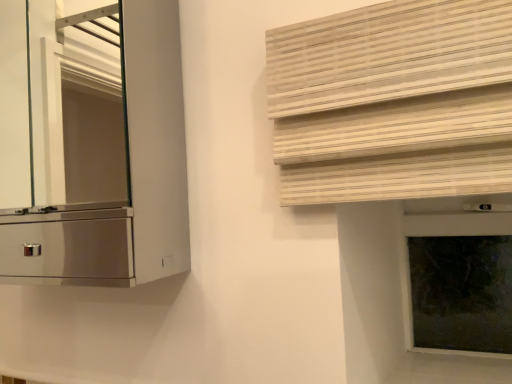
Question: Does natural wood blinds at upper right have a lesser height compared to metallic silver cabinet at left?

Choices:
 (A) no
 (B) yes

Answer: (B)

Question: From the image's perspective, would you say natural wood blinds at upper right is shown under metallic silver cabinet at left?

Choices:
 (A) no
 (B) yes

Answer: (B)

Question: Can you confirm if natural wood blinds at upper right is wider than metallic silver cabinet at left?

Choices:
 (A) no
 (B) yes

Answer: (A)

Question: Is natural wood blinds at upper right in front of metallic silver cabinet at left?

Choices:
 (A) no
 (B) yes

Answer: (B)

Question: Considering the relative sizes of natural wood blinds at upper right and metallic silver cabinet at left in the image provided, is natural wood blinds at upper right bigger than metallic silver cabinet at left?

Choices:
 (A) yes
 (B) no

Answer: (B)

Question: Is natural wood blinds at upper right outside of metallic silver cabinet at left?

Choices:
 (A) no
 (B) yes

Answer: (B)

Question: Can you confirm if dark glass window frame at right is taller than metallic silver cabinet at left?

Choices:
 (A) yes
 (B) no

Answer: (B)

Question: Does dark glass window frame at right turn towards metallic silver cabinet at left?

Choices:
 (A) no
 (B) yes

Answer: (A)

Question: Could metallic silver cabinet at left be considered to be inside dark glass window frame at right?

Choices:
 (A) no
 (B) yes

Answer: (A)

Question: From a real-world perspective, is dark glass window frame at right located higher than metallic silver cabinet at left?

Choices:
 (A) no
 (B) yes

Answer: (A)

Question: Considering the relative sizes of dark glass window frame at right and metallic silver cabinet at left in the image provided, is dark glass window frame at right smaller than metallic silver cabinet at left?

Choices:
 (A) yes
 (B) no

Answer: (A)

Question: Is dark glass window frame at right shorter than metallic silver cabinet at left?

Choices:
 (A) yes
 (B) no

Answer: (A)

Question: From the image's perspective, would you say dark glass window frame at right is shown under natural wood blinds at upper right?

Choices:
 (A) yes
 (B) no

Answer: (A)